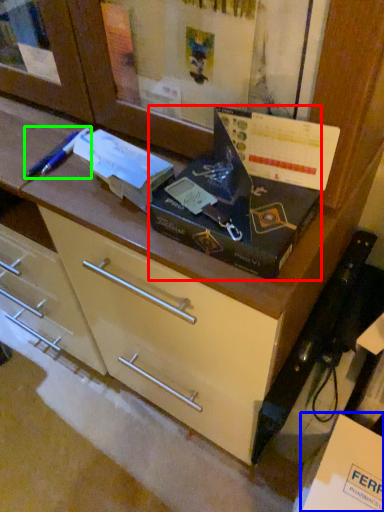
Question: Which object is the closest to the box (highlighted by a red box)? Choose among these: cardboard box (highlighted by a blue box) or penguin (highlighted by a green box).

Choices:
 (A) cardboard box
 (B) penguin

Answer: (B)